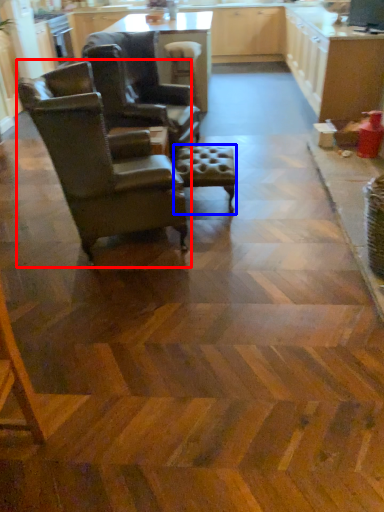
Question: Which object appears farthest to the camera in this image, chair (highlighted by a red box) or bar stool (highlighted by a blue box)?

Choices:
 (A) chair
 (B) bar stool

Answer: (B)